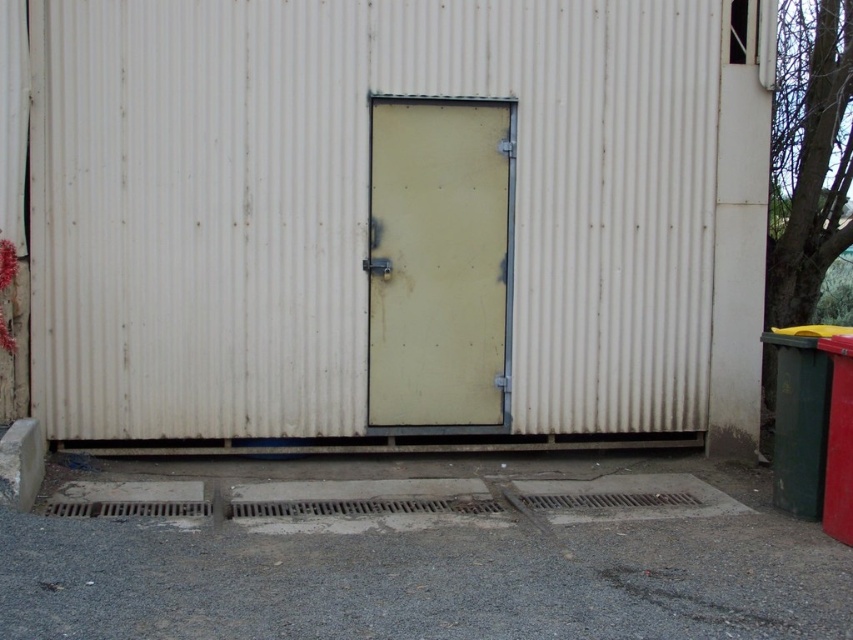
What do you see at coordinates (387, 212) in the screenshot?
I see `white corrugated metal shed at center` at bounding box center [387, 212].

What are the coordinates of `white corrugated metal shed at center` in the screenshot? It's located at (387, 212).

The height and width of the screenshot is (640, 853). What are the coordinates of `white corrugated metal shed at center` in the screenshot? It's located at (387, 212).